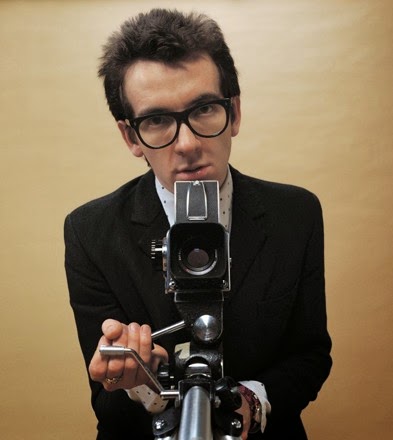
This screenshot has width=393, height=440. I want to click on walls, so click(x=54, y=177), click(x=321, y=160).